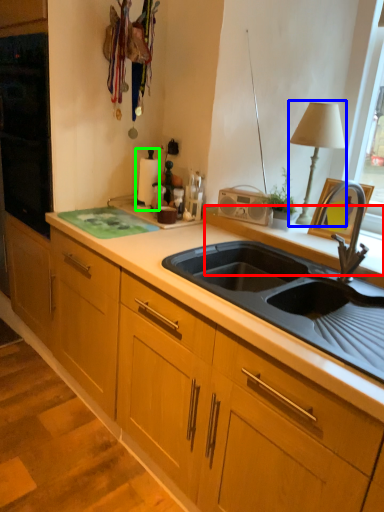
Question: Considering the real-world distances, which object is closest to window sill (highlighted by a red box)? table lamp (highlighted by a blue box) or appliance (highlighted by a green box).

Choices:
 (A) table lamp
 (B) appliance

Answer: (A)